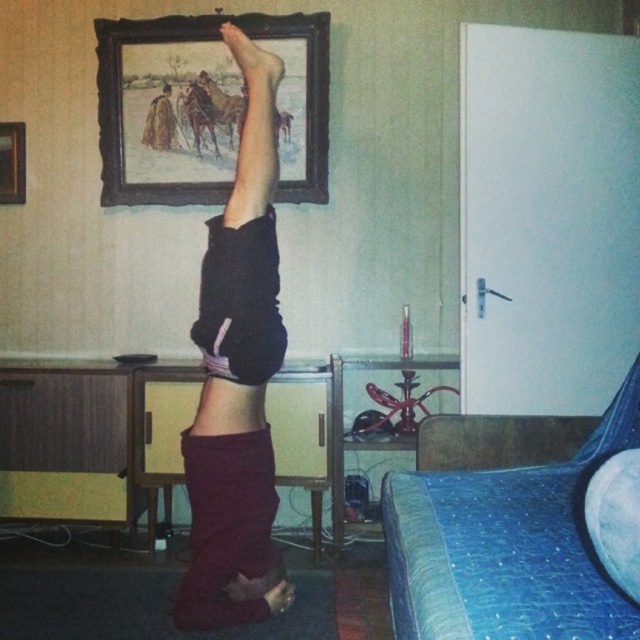
You are designing a layout for a small room and need to place a new sofa. You have two objects in the room already, the blue textured bed at lower right and the brown wooden frame at upper center. Which object should you consider for spacing adjustments since it takes up more horizontal space?

The brown wooden frame at upper center takes up more horizontal space than the blue textured bed at lower right, so you should consider adjusting spacing around the brown wooden frame at upper center.

You are an interior designer assessing the wall layout in the room. You notice two frames on the wall. The first is the brown wooden frame at upper center and the second is the wooden picture frame at upper left. Which of these two frames is positioned to the right when viewed from the front of the room?

The brown wooden frame at upper center is positioned to the right of the wooden picture frame at upper left.

You are a tailor measuring the width of items in the room. You need to determine which item is wider between the maroon fabric pants at center and the wooden picture frame at upper left. Which one is wider?

The maroon fabric pants at center is wider than the wooden picture frame at upper left according to the description.